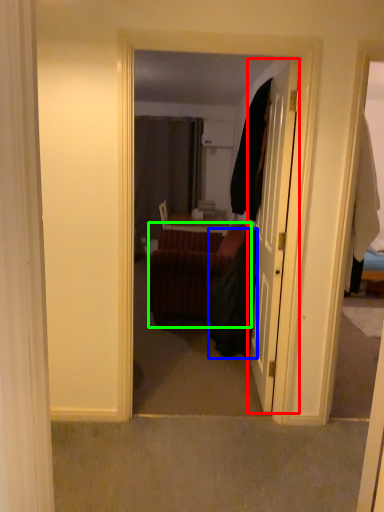
Question: Based on their relative distances, which object is farther from door (highlighted by a red box)? Choose from robe (highlighted by a blue box) and studio couch (highlighted by a green box).

Choices:
 (A) robe
 (B) studio couch

Answer: (B)